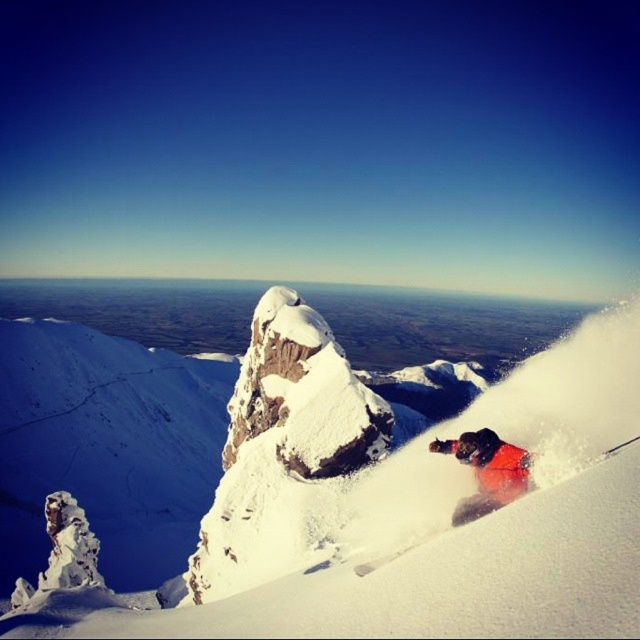
Question: Which object is farther from the camera taking this photo?

Choices:
 (A) white powdery snow at center
 (B) orange snowsuit at lower right

Answer: (B)

Question: Where is white powdery snow at center located in relation to orange snowsuit at lower right in the image?

Choices:
 (A) above
 (B) below

Answer: (B)

Question: Does white powdery snow at center have a greater width compared to orange snowsuit at lower right?

Choices:
 (A) yes
 (B) no

Answer: (A)

Question: Among these objects, which one is farthest from the camera?

Choices:
 (A) white powdery snow at center
 (B) orange snowsuit at lower right

Answer: (B)

Question: Is white powdery snow at center above orange snowsuit at lower right?

Choices:
 (A) yes
 (B) no

Answer: (B)